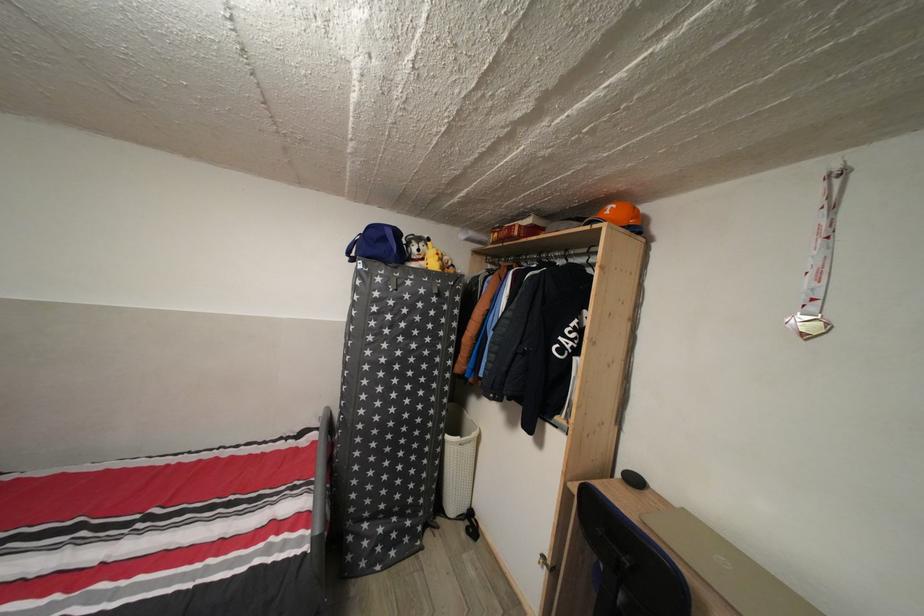
Describe the element at coordinates (391, 411) in the screenshot. The image size is (924, 616). I see `the fabric wardrobe zipper` at that location.